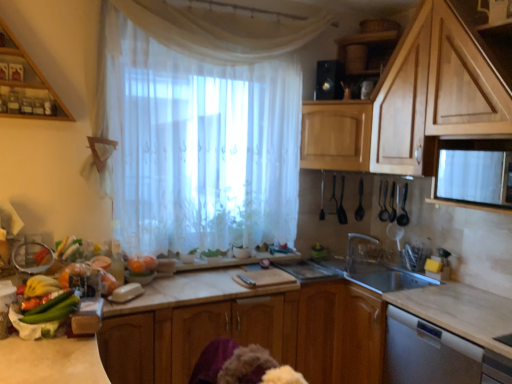
Identify the location of vacant area to the left of silver metallic faucet at lower center. The height and width of the screenshot is (384, 512). (334, 274).